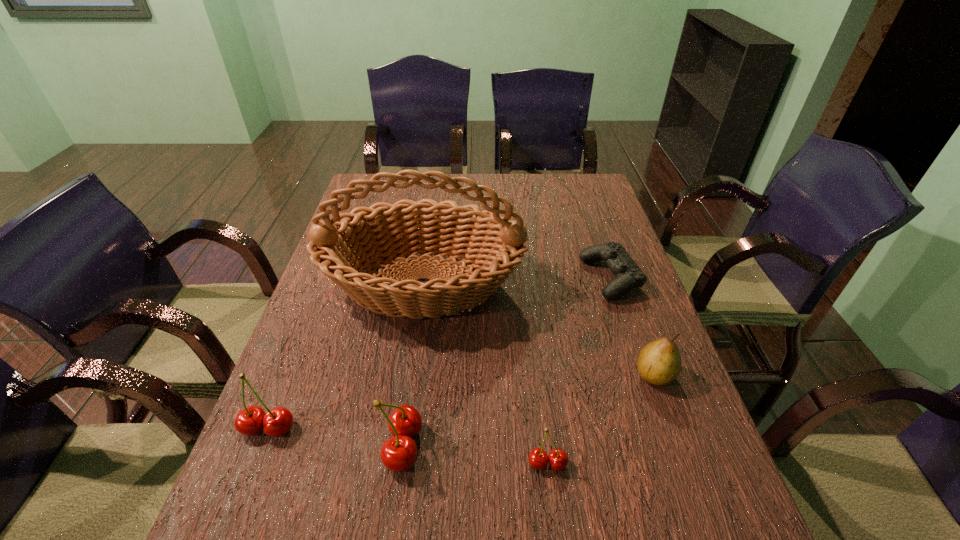
With all cherrys evenly spaced, where should an extra cherry be placed on the right to continue the pattern? Please point out a vacant space. Please provide its 2D coordinates. Your answer should be formatted as a tuple, i.e. [(x, y)], where the tuple contains the x and y coordinates of a point satisfying the conditions above.

[(701, 483)]